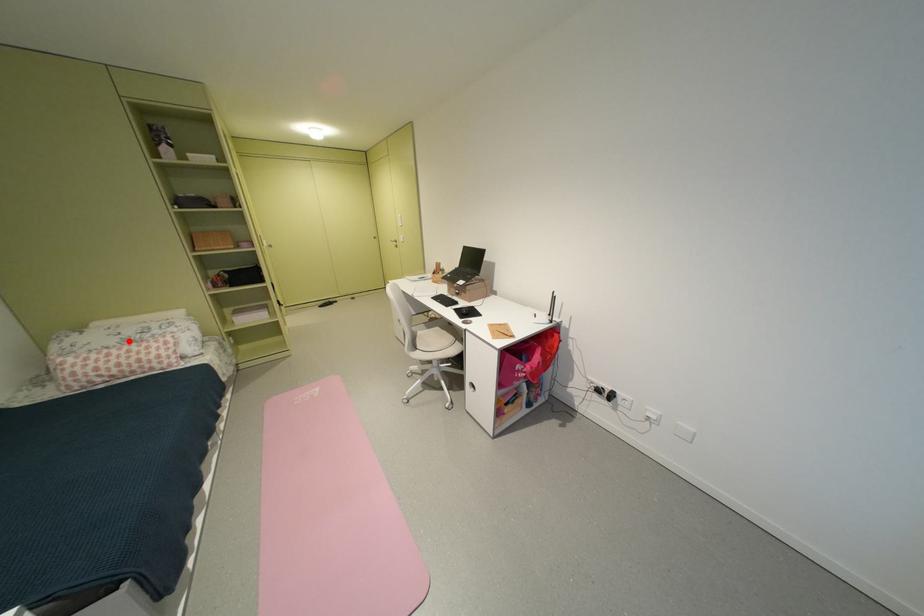
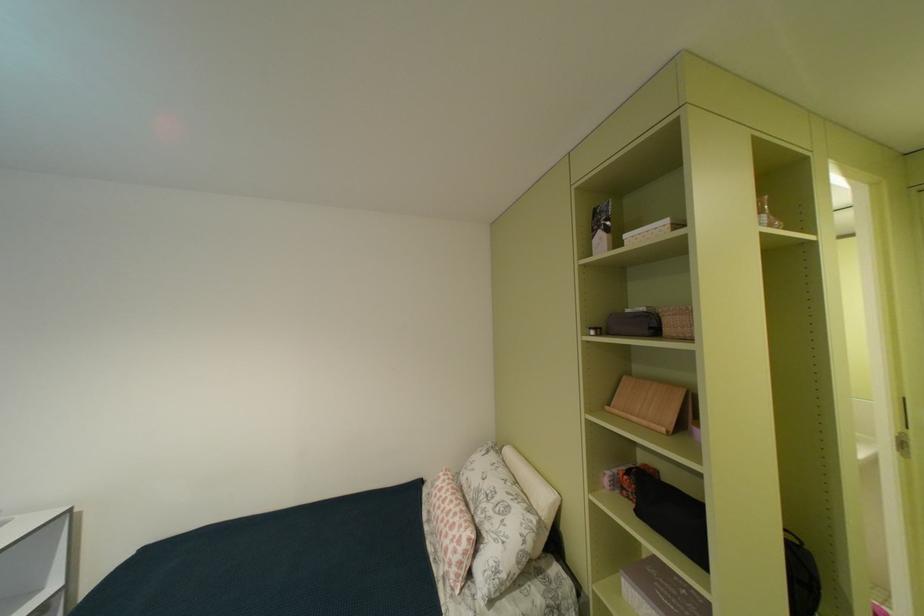
Question: I am providing you with two images of the same scene from different viewpoints. Image1 has a red point marked. In image2, the corresponding 3D location appears at what relative position? Reply with the corresponding letter.

Choices:
 (A) Closer
 (B) Farther

Answer: (B)